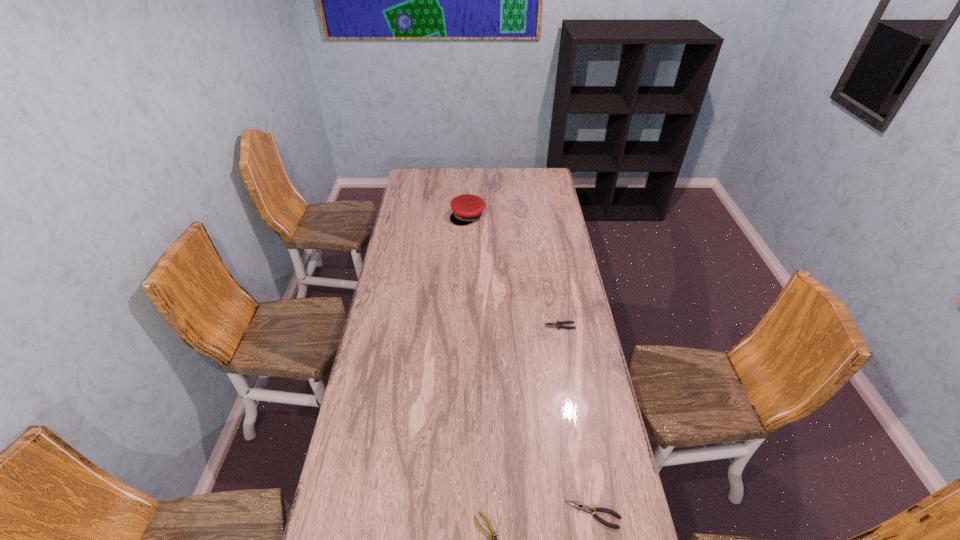
Find the location of `cap`. cap is located at coordinates (467, 208).

The height and width of the screenshot is (540, 960). What are the coordinates of `the farthest object` in the screenshot? It's located at (467, 208).

This screenshot has width=960, height=540. I want to click on the second farthest object, so click(557, 324).

Identify the location of blank area located 0.260m on the front-facing side of the cap. This screenshot has height=540, width=960. (466, 259).

Identify the location of free space located 0.250m at the gripping part of the farthest pliers. (483, 326).

Where is `vacant point located at the gripping part of the farthest pliers`? The image size is (960, 540). vacant point located at the gripping part of the farthest pliers is located at coordinates (478, 326).

I want to click on free region located 0.200m at the gripping part of the farthest pliers, so click(495, 326).

This screenshot has height=540, width=960. In the image, there is a desktop. What are the coordinates of `vacant space at the far edge` in the screenshot? It's located at (519, 181).

Find the location of `free space at the left edge of the desktop`. free space at the left edge of the desktop is located at coordinates (395, 394).

In the image, there is a desktop. Where is `vacant space at the right edge`? Image resolution: width=960 pixels, height=540 pixels. vacant space at the right edge is located at coordinates pyautogui.click(x=556, y=217).